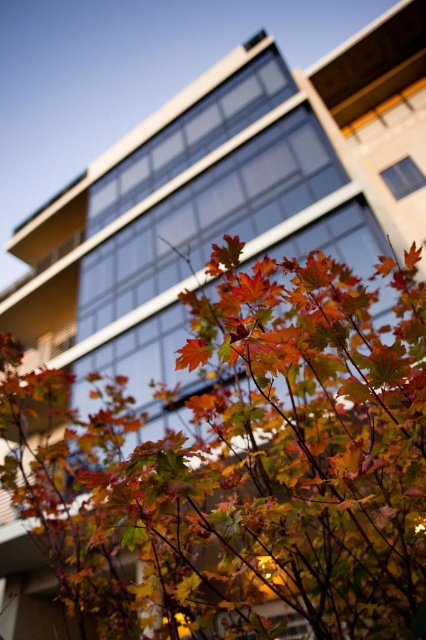
Looking at this image, does autumn leaves at center have a smaller size compared to orange matte maple leaf at center?

Incorrect, autumn leaves at center is not smaller in size than orange matte maple leaf at center.

Is autumn leaves at center above orange matte maple leaf at center?

Incorrect, autumn leaves at center is not positioned above orange matte maple leaf at center.

Who is more forward, (376, 330) or (184, 360)?

Point (184, 360) is in front.

Find the location of a particular element. This screenshot has width=426, height=640. autumn leaves at center is located at coordinates (245, 465).